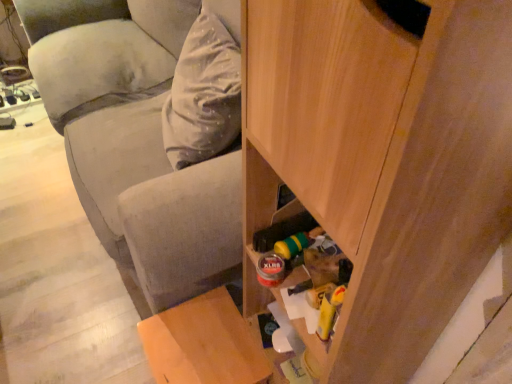
Question: Is wooden cabinet at lower right at the left side of wooden stool at lower left?

Choices:
 (A) no
 (B) yes

Answer: (A)

Question: Is wooden cabinet at lower right positioned behind wooden stool at lower left?

Choices:
 (A) yes
 (B) no

Answer: (B)

Question: Does wooden cabinet at lower right touch wooden stool at lower left?

Choices:
 (A) no
 (B) yes

Answer: (A)

Question: From the image's perspective, is wooden cabinet at lower right under wooden stool at lower left?

Choices:
 (A) yes
 (B) no

Answer: (B)

Question: Is wooden cabinet at lower right oriented away from wooden stool at lower left?

Choices:
 (A) no
 (B) yes

Answer: (A)

Question: Is wooden cabinet at lower right smaller than wooden stool at lower left?

Choices:
 (A) no
 (B) yes

Answer: (A)

Question: Considering the relative sizes of wooden stool at lower left and velvety gray pillow at upper left in the image provided, is wooden stool at lower left bigger than velvety gray pillow at upper left?

Choices:
 (A) no
 (B) yes

Answer: (A)

Question: Is wooden stool at lower left to the left of velvety gray pillow at upper left from the viewer's perspective?

Choices:
 (A) yes
 (B) no

Answer: (B)

Question: From a real-world perspective, is wooden stool at lower left located higher than velvety gray pillow at upper left?

Choices:
 (A) no
 (B) yes

Answer: (A)

Question: Is wooden stool at lower left not near velvety gray pillow at upper left?

Choices:
 (A) yes
 (B) no

Answer: (B)

Question: Is wooden stool at lower left closer to camera compared to velvety gray pillow at upper left?

Choices:
 (A) no
 (B) yes

Answer: (B)

Question: Is wooden stool at lower left facing towards velvety gray pillow at upper left?

Choices:
 (A) no
 (B) yes

Answer: (A)

Question: Is wooden stool at lower left directly adjacent to wooden cabinet at lower right?

Choices:
 (A) no
 (B) yes

Answer: (A)